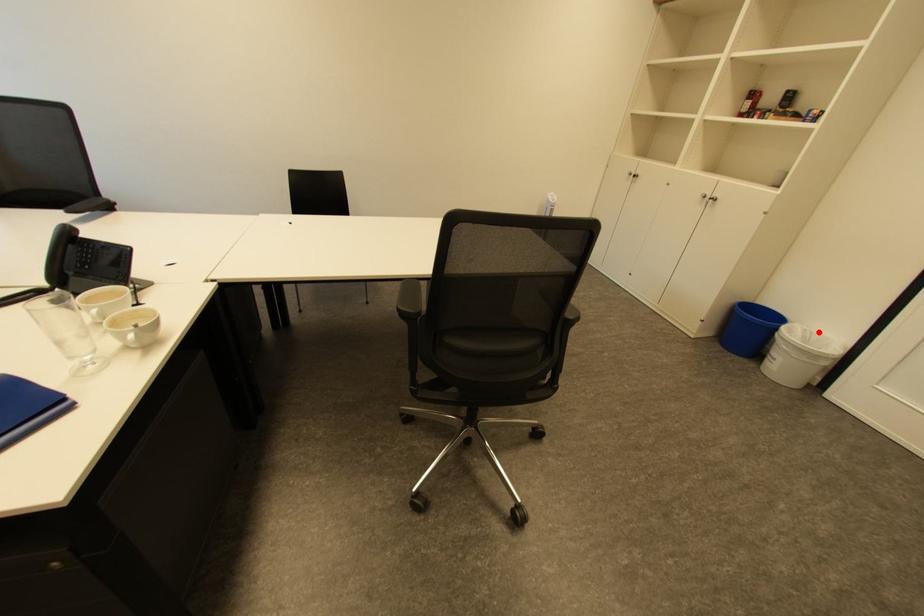
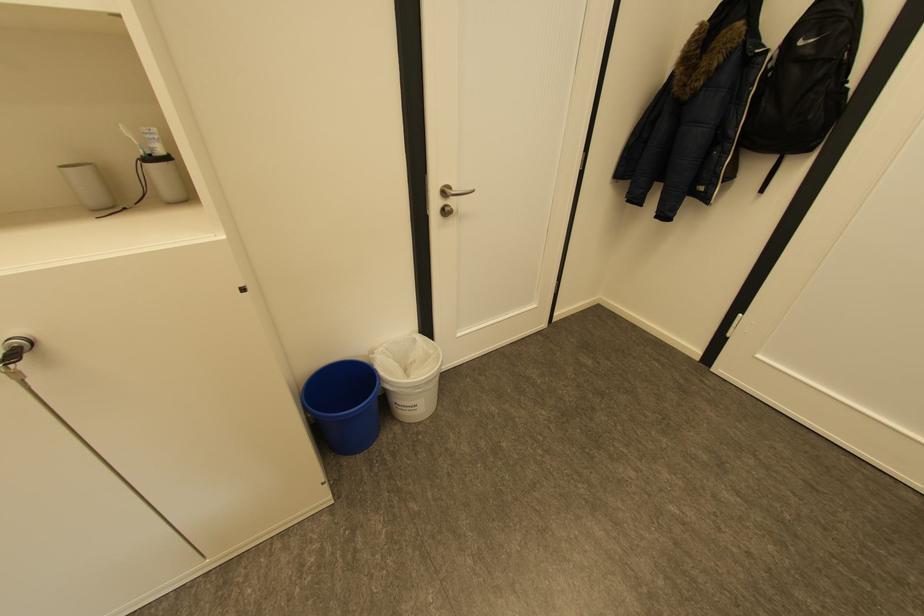
Where in the second image is the point corresponding to the highlighted location from the first image?

(394, 349)